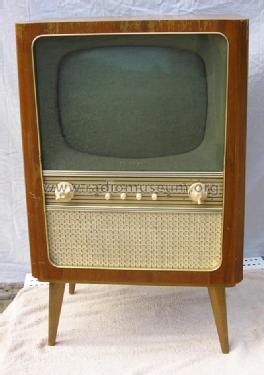
In order to click on top of the tv in this screenshot , I will do `click(104, 18)`.